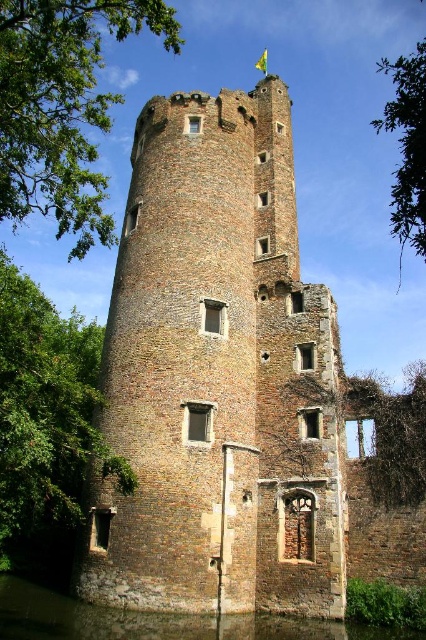
You are standing at the entrance of the historic brick tower and notice a green leafy tree at lower left. Based on its position, can you determine if the tree is closer to the tower or farther away from it?

The green leafy tree at lower left is located at point (46, 419), which means it is closer to the tower than the background elements since lower coordinates in the image typically indicate closer proximity to the viewer.

You are a visitor to the historic brick tower and want to take a photo of the green leafy tree at lower left and the clear water at lower left. Which object would you need to frame more prominently in your shot to capture both?

The green leafy tree at lower left is larger in size than clear water at lower left, so you should frame the green leafy tree at lower left more prominently to ensure both are visible in the photo.